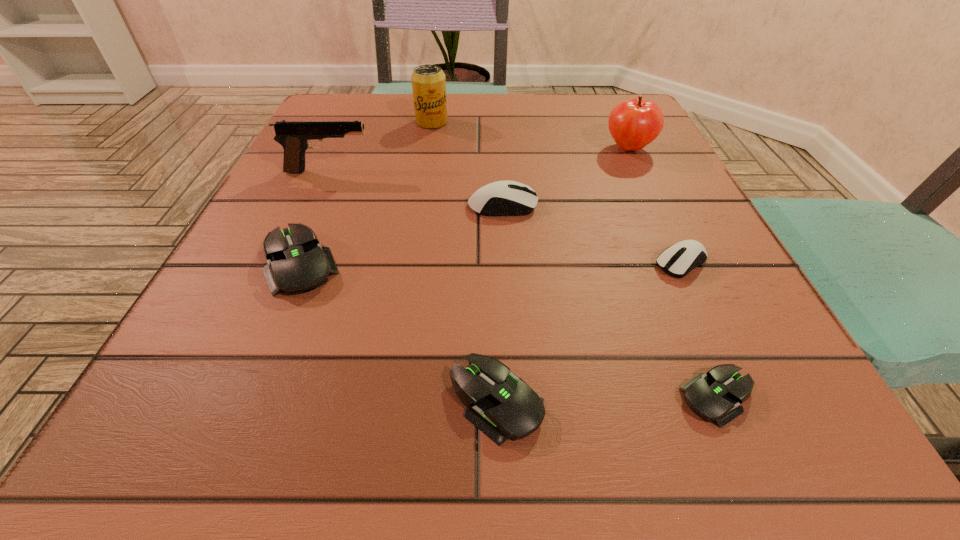
I want to click on free location at the far edge, so (430, 138).

In the image, there is a desktop. Where is `vacant space at the near edge`? This screenshot has width=960, height=540. vacant space at the near edge is located at coordinates (583, 476).

Locate an element on the screen. This screenshot has height=540, width=960. free space at the left edge is located at coordinates 318,221.

Where is `free region at the right edge`? The height and width of the screenshot is (540, 960). free region at the right edge is located at coordinates 661,221.

This screenshot has width=960, height=540. Identify the location of vacant region at the far right corner of the desktop. (608, 95).

In order to click on blank region between the bigger white mouse and the farthest object in this screenshot , I will do `click(468, 164)`.

The width and height of the screenshot is (960, 540). Find the location of `free space between the fourth farthest object and the right white mouse`. free space between the fourth farthest object and the right white mouse is located at coordinates (592, 234).

The height and width of the screenshot is (540, 960). Identify the location of vacant area that lies between the second gray computer mouse from right to left and the left white mouse. (499, 303).

You are a GUI agent. You are given a task and a screenshot of the screen. Output one action in this format:
    pyautogui.click(x=<x>, y=<y>)
    Task: Click on the vacant space that is in between the pistol and the bigger white mouse
    This screenshot has height=540, width=960.
    Given the screenshot: What is the action you would take?
    pyautogui.click(x=416, y=188)

Find the location of `free spot between the beer can and the nearer white mouse`. free spot between the beer can and the nearer white mouse is located at coordinates (557, 192).